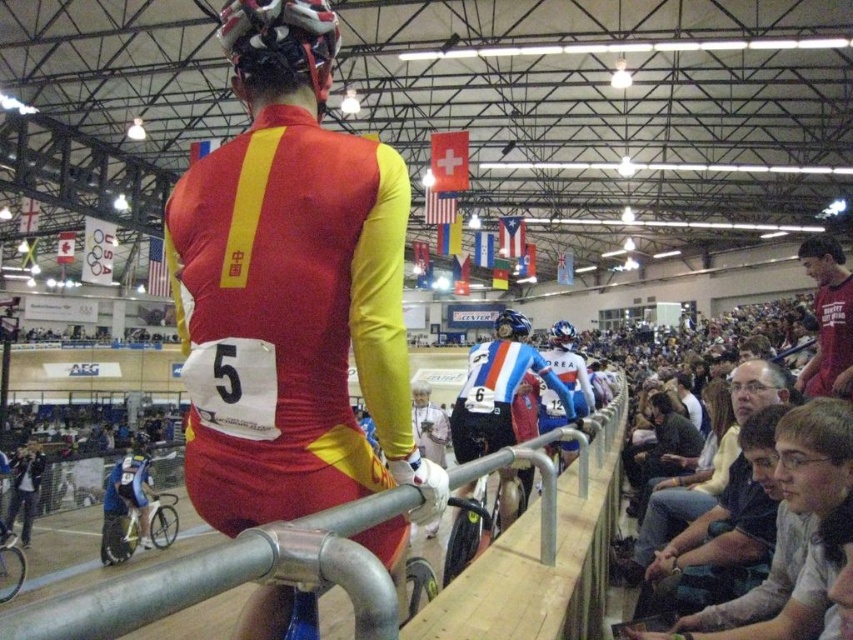
Question: Can you confirm if matte red shirt at right is thinner than blue glossy bicycle helmet at center?

Choices:
 (A) no
 (B) yes

Answer: (A)

Question: Is matte red and yellow cycling suit at center positioned before silver metallic rail at center?

Choices:
 (A) no
 (B) yes

Answer: (A)

Question: From the image, what is the correct spatial relationship of silver metallic rail at center in relation to blue glossy bicycle helmet at center?

Choices:
 (A) below
 (B) above

Answer: (A)

Question: Among these objects, which one is nearest to the camera?

Choices:
 (A) blue glossy bicycle helmet at center
 (B) matte red shirt at right

Answer: (B)

Question: Estimate the real-world distances between objects in this image. Which object is closer to the blue glossy bicycle helmet at center?

Choices:
 (A) shiny metallic helmet at upper center
 (B) silver metallic rail at center
 (C) matte red and yellow cycling suit at center

Answer: (B)

Question: Which object is the farthest from the shiny metallic helmet at upper center?

Choices:
 (A) blue glossy bicycle helmet at center
 (B) matte red and yellow cycling suit at center
 (C) silver metallic rail at center
 (D) matte red shirt at right

Answer: (A)